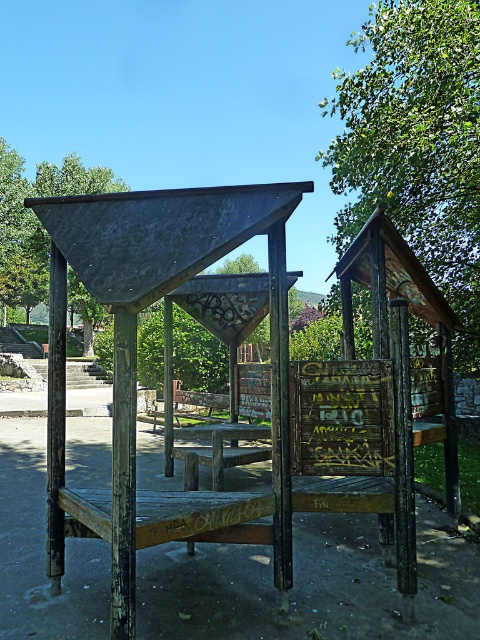
In the scene shown: Who is positioned more to the right, rusty wood gazebo at center or green leafy tree at upper left?

From the viewer's perspective, rusty wood gazebo at center appears more on the right side.

Does rusty wood gazebo at center appear on the right side of green leafy tree at upper left?

Yes, rusty wood gazebo at center is to the right of green leafy tree at upper left.

In the scene shown: Who is more distant from viewer, (277, 224) or (8, 211)?

The point (8, 211) is behind.

Locate an element on the screen. This screenshot has width=480, height=640. rusty wood gazebo at center is located at coordinates (271, 385).

Is rusty wood gazebo at center wider than wooden picnic table at center?

Indeed, rusty wood gazebo at center has a greater width compared to wooden picnic table at center.

Is rusty wood gazebo at center positioned at the back of wooden picnic table at center?

No, it is not.

Locate an element on the screen. rusty wood gazebo at center is located at coordinates (271, 385).

Where is `rusty wood gazebo at center`? The image size is (480, 640). rusty wood gazebo at center is located at coordinates (271, 385).

Does rusty wood gazebo at center appear over green leafy tree at upper right?

No, rusty wood gazebo at center is not above green leafy tree at upper right.

Which is in front, point (439, 323) or point (479, 170)?

Point (439, 323) is more forward.

At what (x,y) coordinates should I click in order to perform the action: click on rusty wood gazebo at center. Please return your answer as a coordinate pair (x, y). This screenshot has width=480, height=640. Looking at the image, I should click on (271, 385).